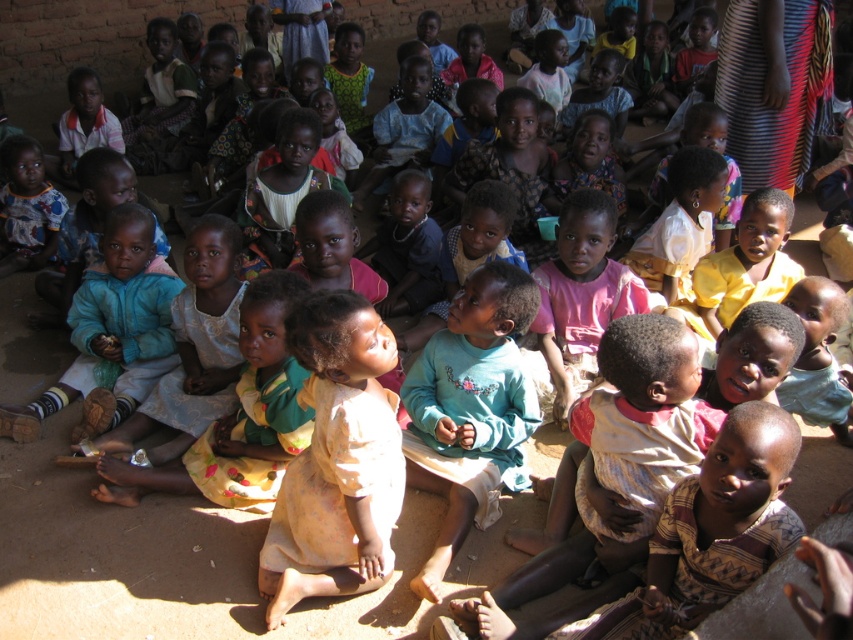
Question: Which object is closer to the camera taking this photo?

Choices:
 (A) light blue cotton shirt at center
 (B) light yellow fabric at center

Answer: (B)

Question: Considering the relative positions of light yellow fabric at center and light blue cotton shirt at center in the image provided, where is light yellow fabric at center located with respect to light blue cotton shirt at center?

Choices:
 (A) left
 (B) right

Answer: (A)

Question: Is light yellow fabric at center closer to camera compared to light blue cotton shirt at center?

Choices:
 (A) yes
 (B) no

Answer: (A)

Question: Among these objects, which one is nearest to the camera?

Choices:
 (A) light yellow fabric at center
 (B) light blue cotton shirt at center

Answer: (A)

Question: Is light yellow fabric at center smaller than light blue cotton shirt at center?

Choices:
 (A) yes
 (B) no

Answer: (A)

Question: Which of the following is the farthest from the observer?

Choices:
 (A) coord(340,470)
 (B) coord(515,269)

Answer: (B)